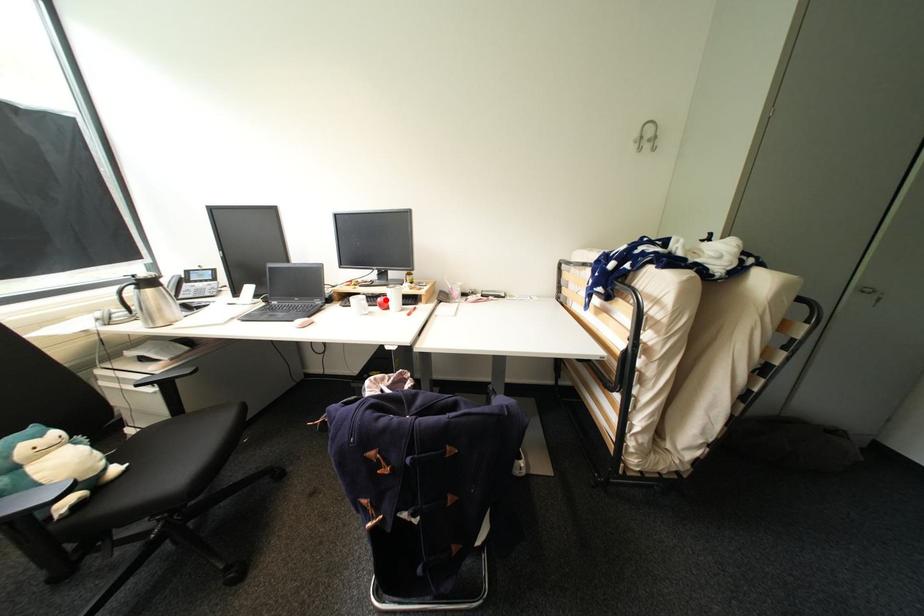
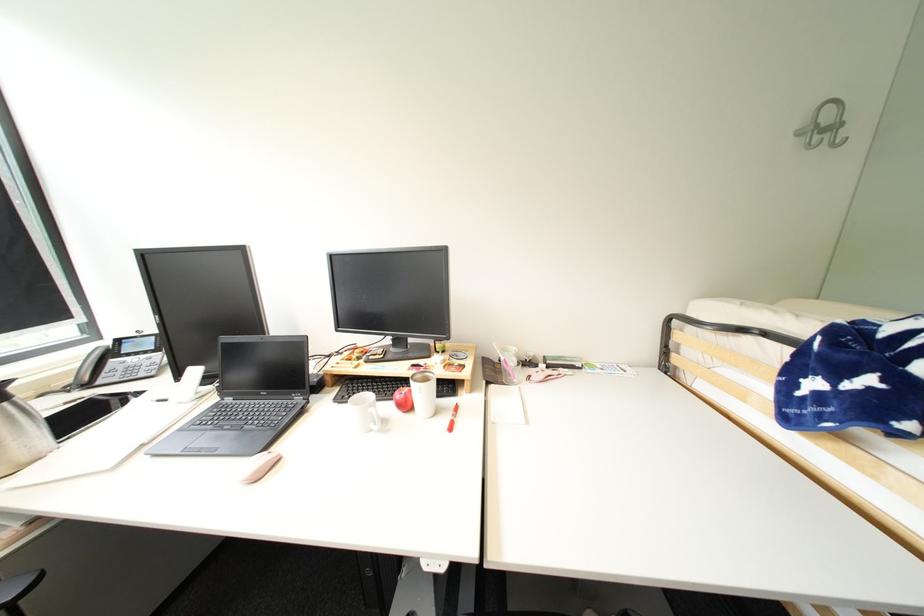
Question: I am providing you with two images of the same scene from different viewpoints. A red point is shown in image1. For the corresponding object point in image2, is it positioned nearer or farther from the camera?

Choices:
 (A) Nearer
 (B) Farther

Answer: (B)